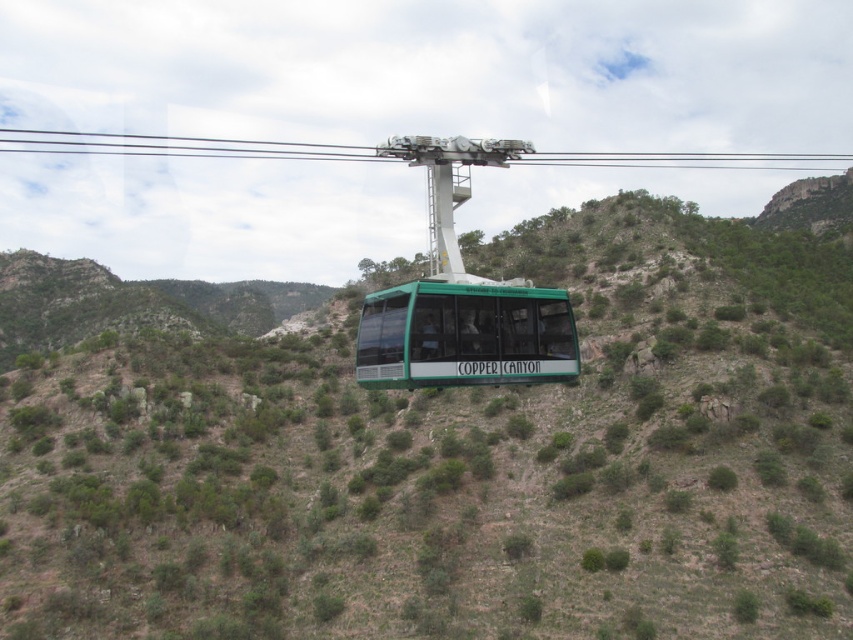
Question: In this image, where is green matte cable car at center located relative to green matte/glass cable car at center?

Choices:
 (A) left
 (B) right

Answer: (B)

Question: Is green matte cable car at center to the right of green matte/glass cable car at center from the viewer's perspective?

Choices:
 (A) no
 (B) yes

Answer: (B)

Question: Does green matte cable car at center appear under green matte/glass cable car at center?

Choices:
 (A) yes
 (B) no

Answer: (B)

Question: Among these points, which one is farthest from the camera?

Choices:
 (A) (252, 545)
 (B) (424, 337)

Answer: (A)